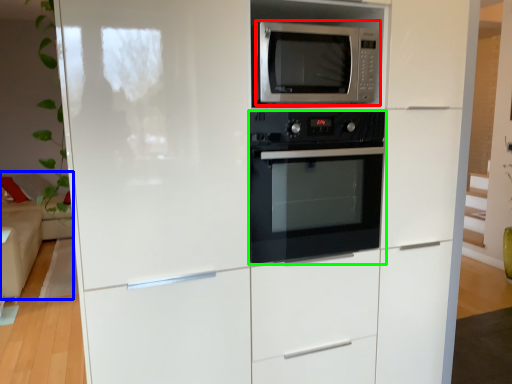
Question: Estimate the real-world distances between objects in this image. Which object is closer to microwave oven (highlighted by a red box), couch (highlighted by a blue box) or oven (highlighted by a green box)?

Choices:
 (A) couch
 (B) oven

Answer: (B)